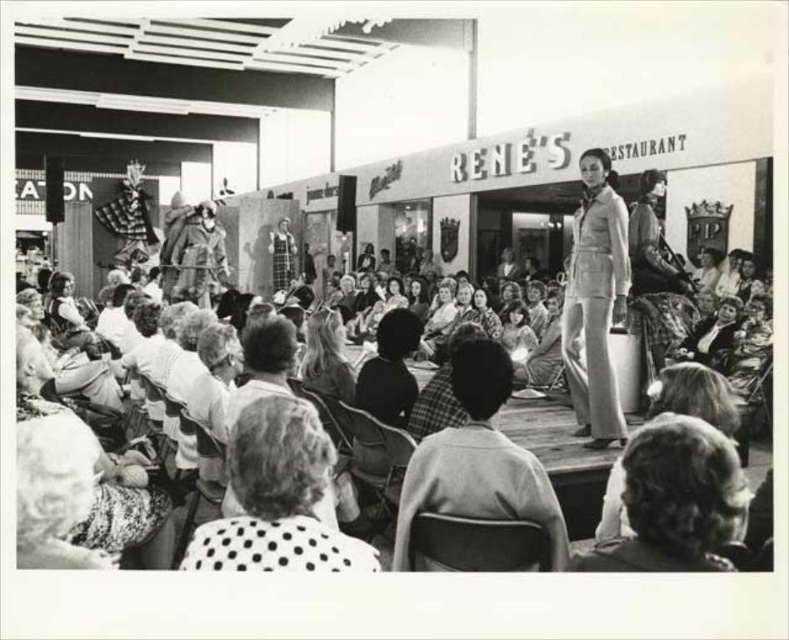
You are a fashion designer observing the vintage fashion show. You notice a point marked at coordinate (277, 497) on your map. What object is located at that coordinate?

The point at coordinate (277, 497) corresponds to the polka dot fabric at lower center.

You are a photographer at the vintage fashion show. You need to take a photo of the model wearing the plaid fabric jacket at center and the dark hair at center. To ensure both are in the frame, where should you position your camera relative to the model?

The plaid fabric jacket at center is to the right of dark hair at center. Position the camera so it captures both the plaid fabric jacket at center and the dark hair at center by centering the camera between them, ensuring the jacket is on the right side of the dark hair in the frame.

You are a photographer at the vintage fashion show. You want to capture a closeup of the model with white textured hair at lower left. Which direction should you move your camera to focus on them?

You should move your camera to the lower left to focus on the white textured hair at lower left, as it is located at point (54,492).